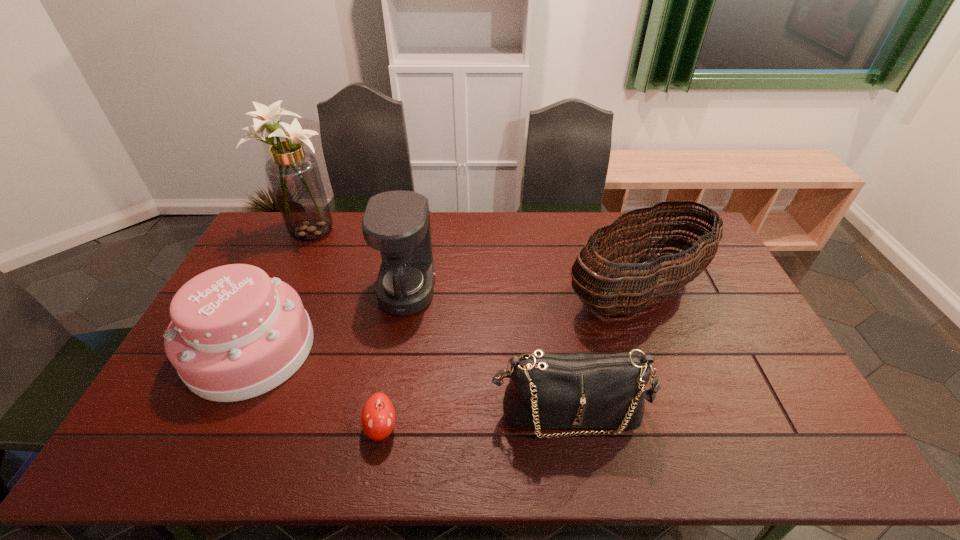
At what (x,y) coordinates should I click in order to perform the action: click on free area in between the birthday cake and the shortest object. Please return your answer as a coordinate pair (x, y). The height and width of the screenshot is (540, 960). Looking at the image, I should click on (316, 388).

The width and height of the screenshot is (960, 540). I want to click on vacant area between the shortest object and the basket, so 509,360.

You are a GUI agent. You are given a task and a screenshot of the screen. Output one action in this format:
    pyautogui.click(x=<x>, y=<y>)
    Task: Click on the object that is the closest to the birthday cake
    
    Given the screenshot: What is the action you would take?
    pyautogui.click(x=397, y=223)

Locate which object ranks fifth in proximity to the coffee maker. Please provide its 2D coordinates. Your answer should be formatted as a tuple, i.e. [(x, y)], where the tuple contains the x and y coordinates of a point satisfying the conditions above.

[(627, 292)]

Identify the location of free space that satisfies the following two spatial constraints: 1. on the button side of the basket; 2. on the right side of the coffee maker. (407, 293).

Locate an element on the screen. free space that satisfies the following two spatial constraints: 1. on the back side of the apple; 2. on the left side of the basket is located at coordinates (405, 293).

What are the coordinates of `vacant point that satisfies the following two spatial constraints: 1. on the front side of the tallest object; 2. on the right side of the shortest object` in the screenshot? It's located at (219, 428).

You are a GUI agent. You are given a task and a screenshot of the screen. Output one action in this format:
    pyautogui.click(x=<x>, y=<y>)
    Task: Click on the vacant position in the image that satisfies the following two spatial constraints: 1. on the button side of the fifth shortest object; 2. on the front side of the apple
    
    Given the screenshot: What is the action you would take?
    pyautogui.click(x=384, y=428)